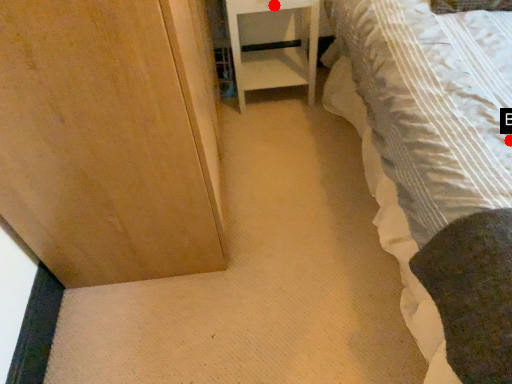
Question: Two points are circled on the image, labeled by A and B beside each circle. Which point is closer to the camera?

Choices:
 (A) A is closer
 (B) B is closer

Answer: (B)